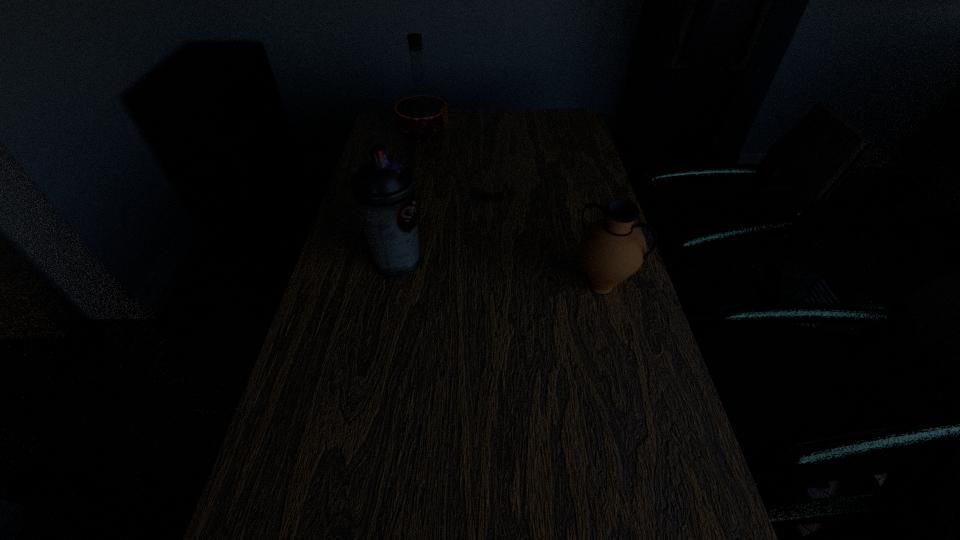
The image size is (960, 540). What are the coordinates of `empty location between the second farthest object and the third tallest object` in the screenshot? It's located at (547, 244).

Locate an element on the screen. This screenshot has height=540, width=960. empty space that is in between the second farthest object and the third tallest object is located at coordinates (547, 244).

Locate an element on the screen. The height and width of the screenshot is (540, 960). vacant region between the aerosol can and the third nearest object is located at coordinates (445, 232).

You are a GUI agent. You are given a task and a screenshot of the screen. Output one action in this format:
    pyautogui.click(x=<x>, y=<y>)
    Task: Click on the free space between the third object from left to right and the aerosol can
    The height and width of the screenshot is (540, 960).
    Given the screenshot: What is the action you would take?
    pyautogui.click(x=445, y=232)

At what (x,y) coordinates should I click in order to perform the action: click on free spot between the liquor and the cherry. Please return your answer as a coordinate pair (x, y). This screenshot has height=540, width=960. Looking at the image, I should click on (458, 168).

What are the coordinates of `vacant space that is in between the pitcher and the cherry` in the screenshot? It's located at (547, 244).

Image resolution: width=960 pixels, height=540 pixels. I want to click on empty space that is in between the third nearest object and the rightmost object, so click(x=547, y=244).

Image resolution: width=960 pixels, height=540 pixels. Identify the location of free point between the aerosol can and the pitcher. (499, 274).

Find the location of `unoccupied area between the liquor and the third nearest object`. unoccupied area between the liquor and the third nearest object is located at coordinates (458, 168).

Locate an element on the screen. Image resolution: width=960 pixels, height=540 pixels. object that is the nearest to the pitcher is located at coordinates (498, 196).